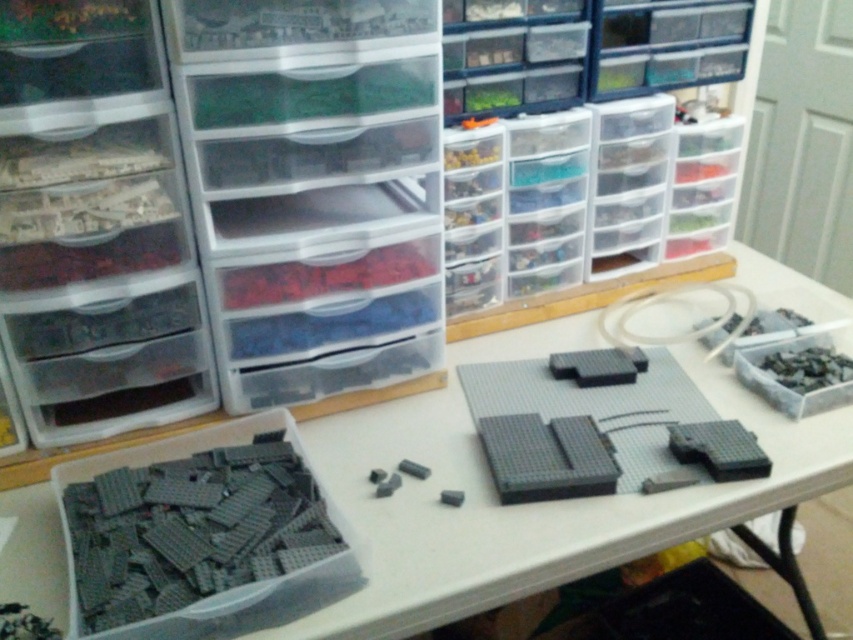
Which is above, transparent plastic table at center or gray matte lego bricks at lower left?

Positioned higher is transparent plastic table at center.

Which is behind, point (318, 436) or point (253, 419)?

The point (318, 436) is behind.

At what (x,y) coordinates should I click in order to perform the action: click on transparent plastic table at center. Please return your answer as a coordinate pair (x, y). The height and width of the screenshot is (640, 853). Looking at the image, I should click on pos(524,504).